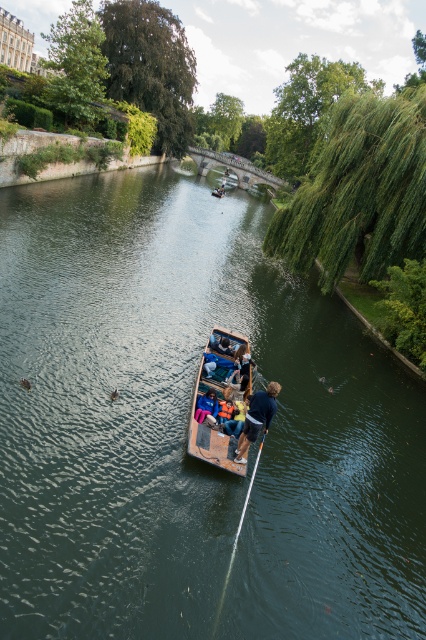
You are standing at the point with coordinates [236,538] in the image. What object is located exactly at that point?

The white plastic paddle at center is located exactly at point [236,538].

You are standing on the stone bridge and see the wooden boat at center and the blue fabric jacket at center in the river below. Which object is closer to the bridge?

The blue fabric jacket at center is closer to the bridge because the wooden boat at center is to the left of it, meaning the jacket is positioned between the boat and the bridge.

You are standing on the stone bridge and want to know which of the two points, point (222, 586) or point (210, 396), is closer to you. Which one is closer?

Point (222, 586) is closer to the viewer than point (210, 396).